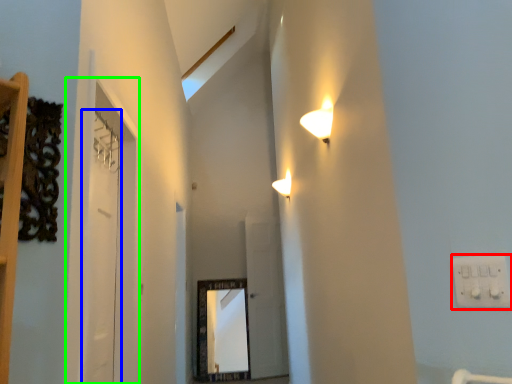
Question: Based on their relative distances, which object is nearer to electric outlet (highlighted by a red box)? Choose from door (highlighted by a blue box) and glass door (highlighted by a green box).

Choices:
 (A) door
 (B) glass door

Answer: (B)